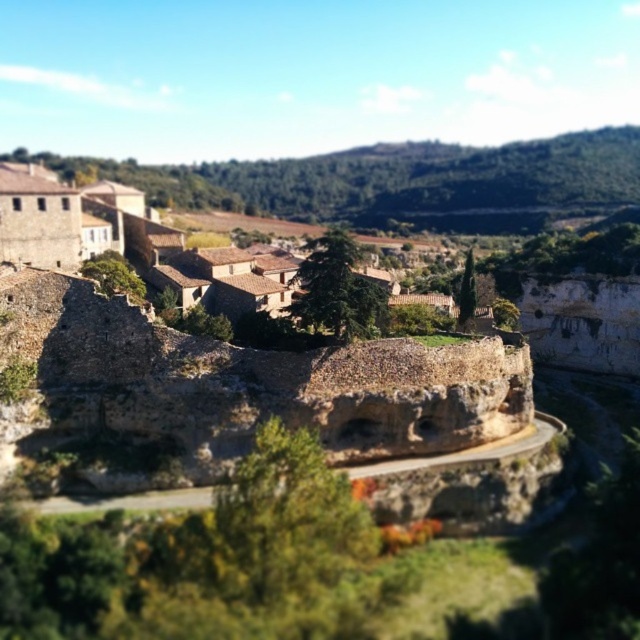
You are standing at the viewpoint overlooking the village and the rocky outcrop. You notice two points marked in the image. Which of the two points, point (97, 346) or point (275, 269), is closer to your current position?

Point (97, 346) is closer to the camera than point (275, 269), so it is closer to your current position.

You are a hiker standing at the base of the brown rough stone wall at center. You want to take a photo of the brown stone village at upper left. Which direction should you face to capture both the wall and the village in the same frame?

To capture both the brown rough stone wall at center and the brown stone village at upper left in the same frame, you should face towards the upper left direction. This way, the village will be visible above and to the left of the wall, which is shorter than the village.